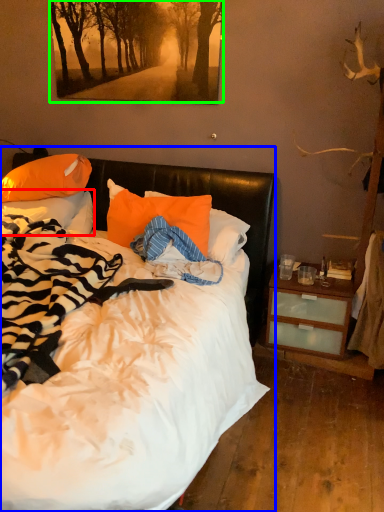
Question: Which object is positioned closest to pillow (highlighted by a red box)? Select from bed (highlighted by a blue box) and tree (highlighted by a green box).

Choices:
 (A) bed
 (B) tree

Answer: (B)